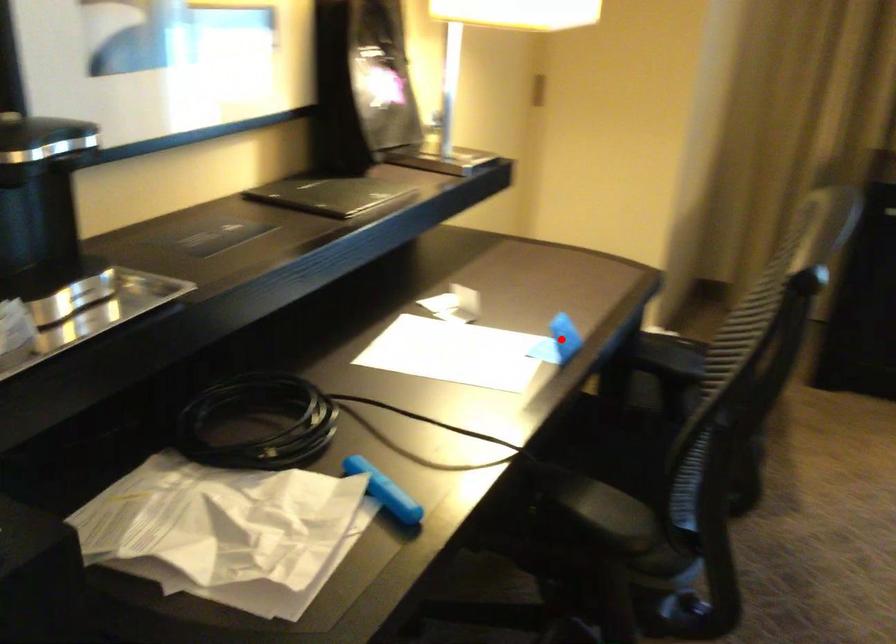
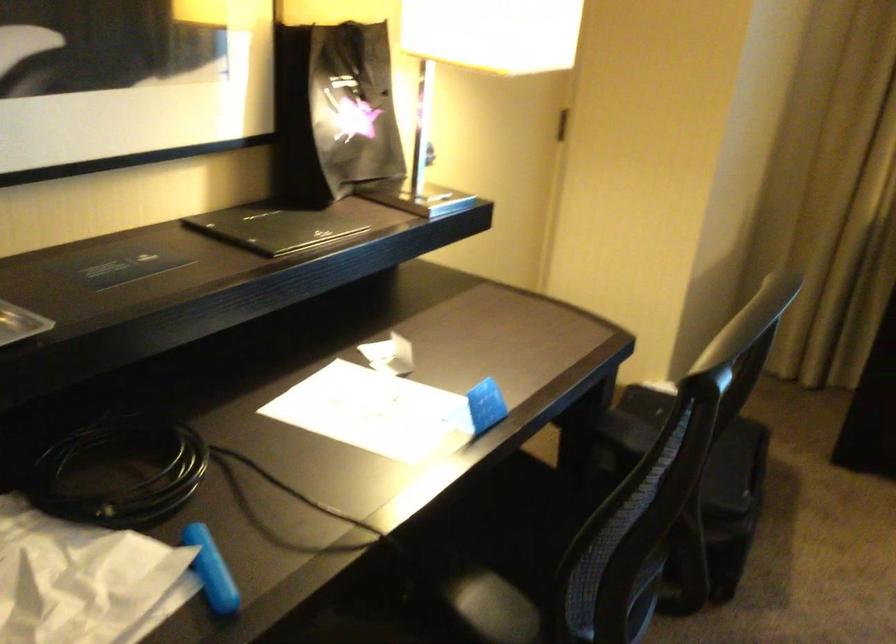
The point at the highlighted location is marked in the first image. Where is the corresponding point in the second image?

(479, 408)